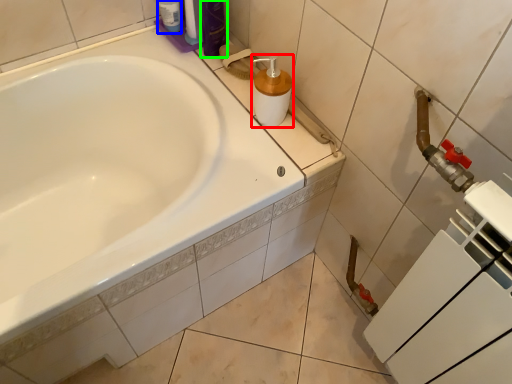
Question: Considering the real-world distances, which object is closest to soap dispenser (highlighted by a red box)? toiletry (highlighted by a blue box) or toiletry (highlighted by a green box).

Choices:
 (A) toiletry
 (B) toiletry

Answer: (B)